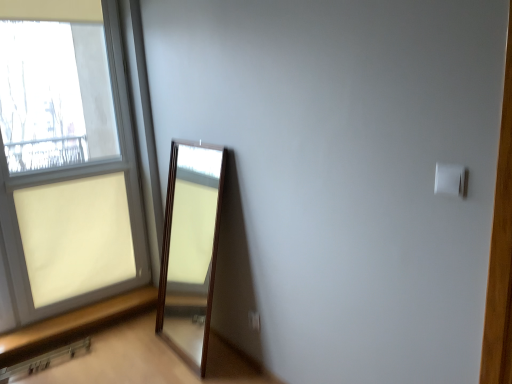
Question: Does brown wooden window sill at lower left lie in front of white plastic light switch at upper right?

Choices:
 (A) yes
 (B) no

Answer: (B)

Question: Is brown wooden window sill at lower left looking in the opposite direction of white plastic light switch at upper right?

Choices:
 (A) yes
 (B) no

Answer: (B)

Question: From the image's perspective, does brown wooden window sill at lower left appear higher than white plastic light switch at upper right?

Choices:
 (A) no
 (B) yes

Answer: (A)

Question: Considering the relative sizes of brown wooden window sill at lower left and white plastic light switch at upper right in the image provided, is brown wooden window sill at lower left thinner than white plastic light switch at upper right?

Choices:
 (A) no
 (B) yes

Answer: (A)

Question: Is brown wooden window sill at lower left not close to white plastic light switch at upper right?

Choices:
 (A) yes
 (B) no

Answer: (A)

Question: Is brown wooden window sill at lower left aimed at white plastic light switch at upper right?

Choices:
 (A) yes
 (B) no

Answer: (B)

Question: Can you confirm if white plastic light switch at upper right is thinner than white plastic electric outlet at lower center?

Choices:
 (A) no
 (B) yes

Answer: (B)

Question: Considering the relative sizes of white plastic light switch at upper right and white plastic electric outlet at lower center in the image provided, is white plastic light switch at upper right shorter than white plastic electric outlet at lower center?

Choices:
 (A) no
 (B) yes

Answer: (A)

Question: Is white plastic light switch at upper right far from white plastic electric outlet at lower center?

Choices:
 (A) no
 (B) yes

Answer: (B)

Question: Is white plastic light switch at upper right outside white plastic electric outlet at lower center?

Choices:
 (A) no
 (B) yes

Answer: (B)

Question: From a real-world perspective, is white plastic light switch at upper right on top of white plastic electric outlet at lower center?

Choices:
 (A) yes
 (B) no

Answer: (A)

Question: From the image's perspective, is white plastic light switch at upper right located beneath white plastic electric outlet at lower center?

Choices:
 (A) no
 (B) yes

Answer: (A)

Question: Is brown wooden window sill at lower left not close to matte glass window at left?

Choices:
 (A) no
 (B) yes

Answer: (A)